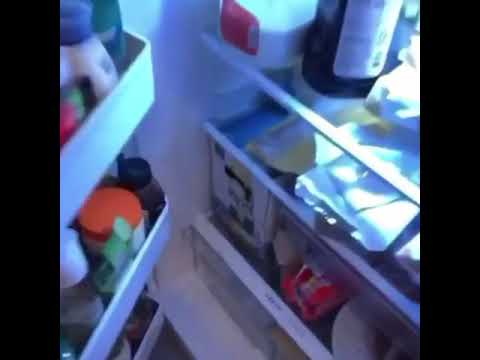
At what (x,y) coordinates should I click in order to perform the action: click on bottle. Please return your answer as a coordinate pair (x, y). This screenshot has width=480, height=360. Looking at the image, I should click on (90, 312).